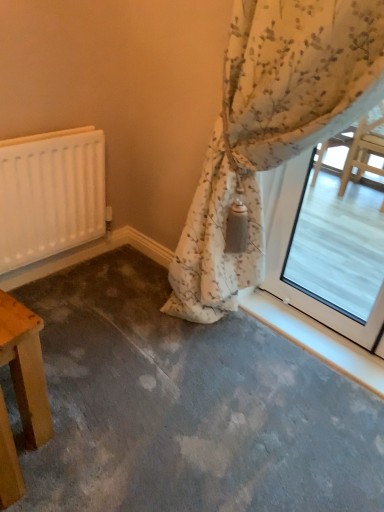
Question: From a real-world perspective, is floral fabric curtain at upper right over wooden table at lower left?

Choices:
 (A) no
 (B) yes

Answer: (B)

Question: Is floral fabric curtain at upper right not within wooden table at lower left?

Choices:
 (A) yes
 (B) no

Answer: (A)

Question: Does floral fabric curtain at upper right appear on the right side of wooden table at lower left?

Choices:
 (A) yes
 (B) no

Answer: (A)

Question: Is floral fabric curtain at upper right positioned far away from wooden table at lower left?

Choices:
 (A) no
 (B) yes

Answer: (A)

Question: Does floral fabric curtain at upper right have a greater height compared to wooden table at lower left?

Choices:
 (A) yes
 (B) no

Answer: (A)

Question: Does floral fabric curtain at upper right come in front of wooden table at lower left?

Choices:
 (A) yes
 (B) no

Answer: (A)

Question: Would you say floral fabric curtain at upper right is part of white matte radiator at left's contents?

Choices:
 (A) yes
 (B) no

Answer: (B)

Question: Considering the relative sizes of white matte radiator at left and floral fabric curtain at upper right in the image provided, is white matte radiator at left wider than floral fabric curtain at upper right?

Choices:
 (A) no
 (B) yes

Answer: (A)

Question: Does white matte radiator at left lie in front of floral fabric curtain at upper right?

Choices:
 (A) yes
 (B) no

Answer: (B)

Question: Does white matte radiator at left have a lesser width compared to floral fabric curtain at upper right?

Choices:
 (A) yes
 (B) no

Answer: (A)

Question: From a real-world perspective, does white matte radiator at left sit lower than floral fabric curtain at upper right?

Choices:
 (A) no
 (B) yes

Answer: (B)

Question: From the image's perspective, would you say white matte radiator at left is shown under floral fabric curtain at upper right?

Choices:
 (A) no
 (B) yes

Answer: (A)

Question: Is white matte radiator at left facing towards wooden table at lower left?

Choices:
 (A) no
 (B) yes

Answer: (B)